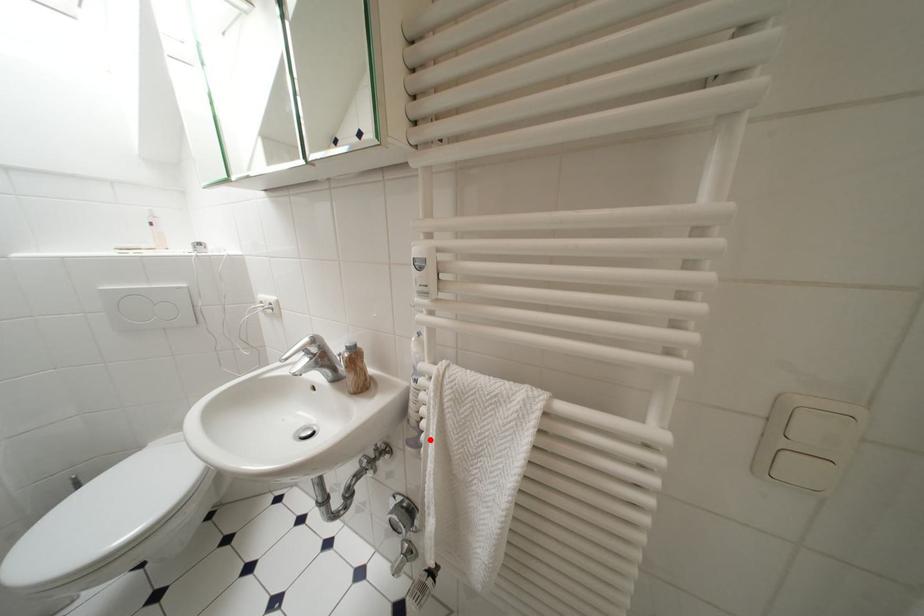
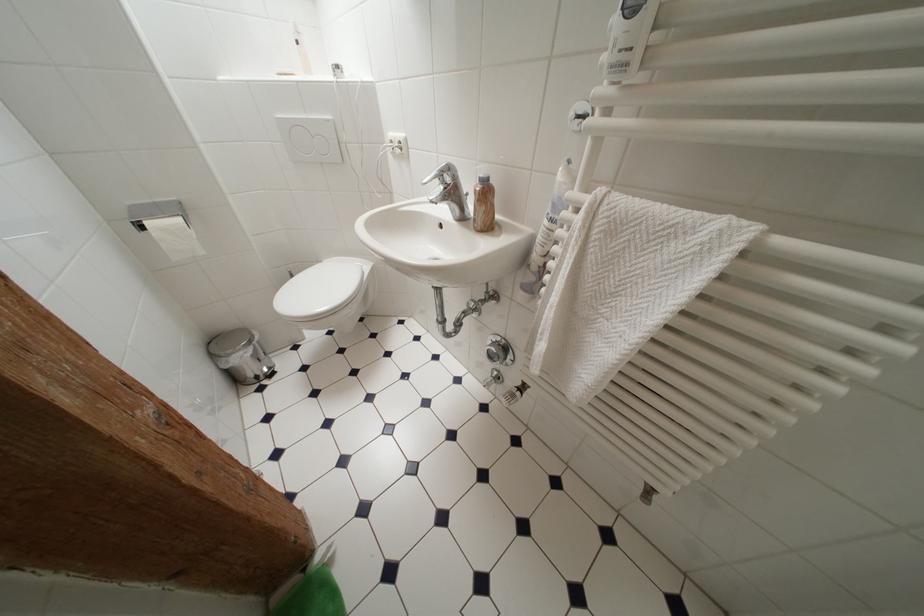
Find the pixel in the second image that matches the highlighted location in the first image.

(553, 280)